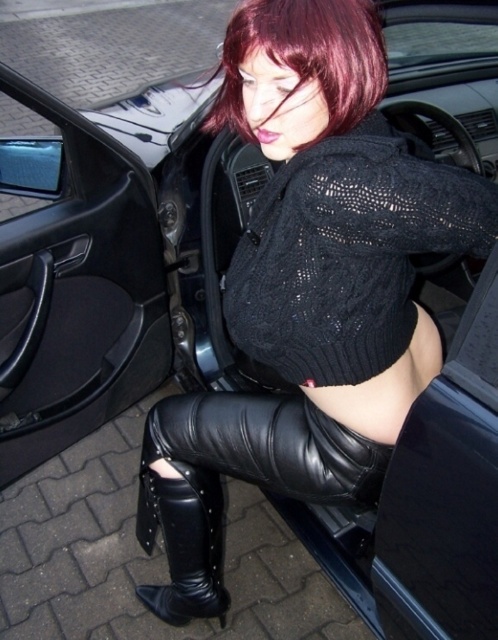
Question: Among these points, which one is nearest to the camera?

Choices:
 (A) (288, 61)
 (B) (148, 595)

Answer: (A)

Question: Is black knitted sweater at center further to the viewer compared to shiny burgundy hair at upper center?

Choices:
 (A) yes
 (B) no

Answer: (B)

Question: Considering the real-world distances, which object is closest to the black knitted sweater at center?

Choices:
 (A) black leather boot at lower center
 (B) shiny burgundy hair at upper center
 (C) black leather car door at lower left
 (D) black leather pants at lower center

Answer: (B)

Question: Can you confirm if black leather car door at lower left is positioned above black leather pants at lower center?

Choices:
 (A) no
 (B) yes

Answer: (B)

Question: Which of these objects is positioned farthest from the black leather pants at lower center?

Choices:
 (A) black knitted sweater at center
 (B) black leather car door at lower left
 (C) black leather boot at lower center

Answer: (B)

Question: In this image, where is black knitted sweater at center located relative to shiny burgundy hair at upper center?

Choices:
 (A) right
 (B) left

Answer: (A)